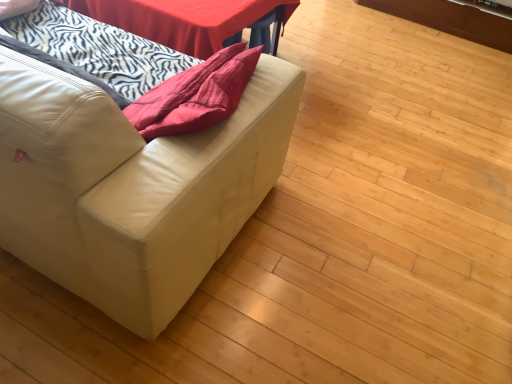
Question: Is smooth red table at upper center not within white zebra-patterned blanket at left?

Choices:
 (A) yes
 (B) no

Answer: (A)

Question: Considering the relative sizes of smooth red table at upper center and white zebra-patterned blanket at left in the image provided, is smooth red table at upper center taller than white zebra-patterned blanket at left?

Choices:
 (A) yes
 (B) no

Answer: (B)

Question: From a real-world perspective, is smooth red table at upper center physically above white zebra-patterned blanket at left?

Choices:
 (A) yes
 (B) no

Answer: (B)

Question: Is the depth of smooth red table at upper center less than that of white zebra-patterned blanket at left?

Choices:
 (A) no
 (B) yes

Answer: (A)

Question: Is smooth red table at upper center thinner than white zebra-patterned blanket at left?

Choices:
 (A) yes
 (B) no

Answer: (B)

Question: Based on their sizes in the image, would you say white zebra-patterned blanket at left is bigger or smaller than white leather couch at left?

Choices:
 (A) small
 (B) big

Answer: (A)

Question: Considering the positions of white zebra-patterned blanket at left and white leather couch at left in the image, is white zebra-patterned blanket at left wider or thinner than white leather couch at left?

Choices:
 (A) thin
 (B) wide

Answer: (A)

Question: From the image's perspective, relative to white leather couch at left, is white zebra-patterned blanket at left above or below?

Choices:
 (A) below
 (B) above

Answer: (B)

Question: Considering the positions of white zebra-patterned blanket at left and white leather couch at left in the image, is white zebra-patterned blanket at left taller or shorter than white leather couch at left?

Choices:
 (A) short
 (B) tall

Answer: (A)

Question: From their relative heights in the image, would you say white zebra-patterned blanket at left is taller or shorter than smooth red table at upper center?

Choices:
 (A) short
 (B) tall

Answer: (B)

Question: Which is correct: white zebra-patterned blanket at left is inside smooth red table at upper center, or outside of it?

Choices:
 (A) inside
 (B) outside

Answer: (B)

Question: Looking at the image, does white zebra-patterned blanket at left seem bigger or smaller compared to smooth red table at upper center?

Choices:
 (A) big
 (B) small

Answer: (B)

Question: From a real-world perspective, is white zebra-patterned blanket at left positioned above or below smooth red table at upper center?

Choices:
 (A) above
 (B) below

Answer: (A)

Question: From the image's perspective, is smooth red table at upper center above or below white leather couch at left?

Choices:
 (A) below
 (B) above

Answer: (B)

Question: Considering the positions of smooth red table at upper center and white leather couch at left in the image, is smooth red table at upper center bigger or smaller than white leather couch at left?

Choices:
 (A) big
 (B) small

Answer: (B)